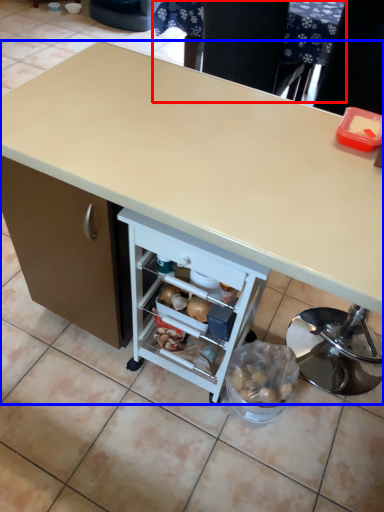
Question: Which object appears farthest to the camera in this image, table (highlighted by a red box) or desk (highlighted by a blue box)?

Choices:
 (A) table
 (B) desk

Answer: (A)